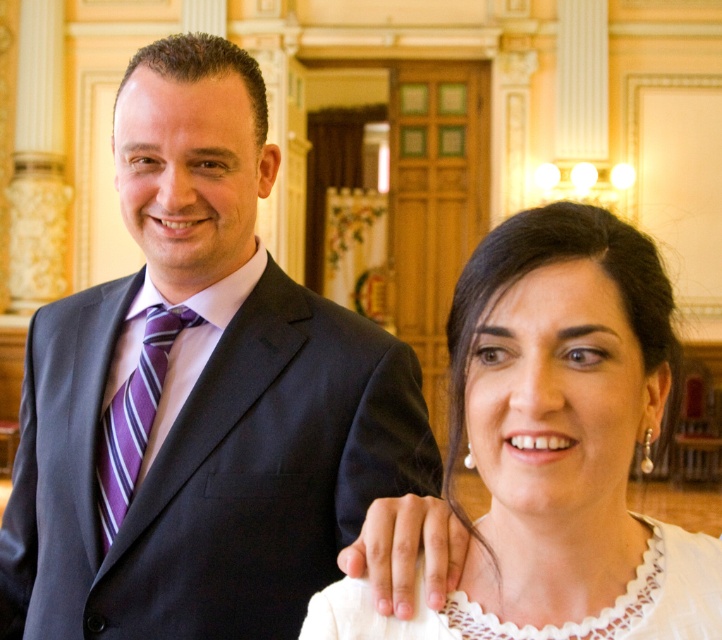
Consider the image. Is white lace dress at center to the right of purple striped tie at left from the viewer's perspective?

Indeed, white lace dress at center is positioned on the right side of purple striped tie at left.

Is point (464, 621) positioned before point (121, 412)?

That is True.

Who is more distant from viewer, (671, 618) or (155, 378)?

The point (155, 378) is behind.

In order to click on white lace dress at center in this screenshot , I will do `click(552, 625)`.

Between point (253, 292) and point (139, 454), which one is positioned in front?

Positioned in front is point (139, 454).

Who is shorter, matte black suit at center or purple striped tie at left?

With less height is purple striped tie at left.

What do you see at coordinates (199, 396) in the screenshot?
I see `matte black suit at center` at bounding box center [199, 396].

This screenshot has width=722, height=640. I want to click on matte black suit at center, so click(x=199, y=396).

Who is more forward, (479, 355) or (375, 625)?

Positioned in front is point (479, 355).

Is white lace blouse at center positioned behind white lace dress at center?

No, it is not.

Describe the element at coordinates (557, 445) in the screenshot. This screenshot has height=640, width=722. I see `white lace blouse at center` at that location.

You are a GUI agent. You are given a task and a screenshot of the screen. Output one action in this format:
    pyautogui.click(x=<x>, y=<y>)
    Task: Click on the white lace blouse at center
    This screenshot has height=640, width=722.
    Given the screenshot: What is the action you would take?
    pyautogui.click(x=557, y=445)